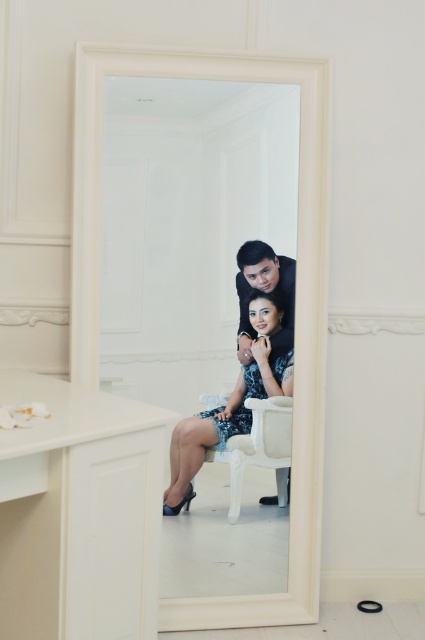
You are an interior designer assessing the placement of the white glossy mirror at center and the shiny blue dress at center in a room. Based on their heights, which object would you recommend placing on a higher shelf to maintain visual balance?

The white glossy mirror at center has a greater height compared to the shiny blue dress at center, so placing the shiny blue dress at center on a higher shelf would help maintain visual balance by balancing their heights.

You are standing in front of the white glossy mirror at center and want to touch the shiny blue dress at center. Can you reach it without moving your position?

The white glossy mirror at center is closer to the viewer than the shiny blue dress at center, so you cannot reach the dress without moving since it is further away.

You are standing in a room and want to see the shiny blue dress at center in the reflection of the white glossy mirror at center. Can you see the dress in the mirror?

The white glossy mirror at center is to the left of the shiny blue dress at center, so yes, the dress would be visible in the mirror as mirrors reflect images.